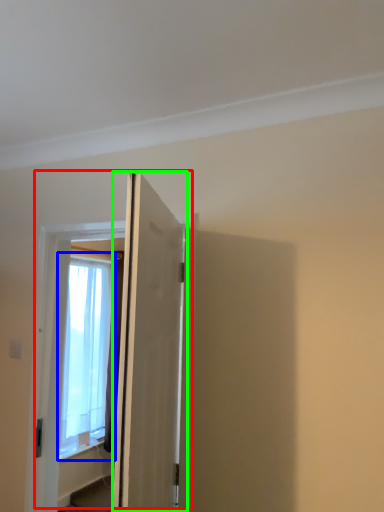
Question: Which object is positioned farthest from door (highlighted by a red box)? Select from window (highlighted by a blue box) and door (highlighted by a green box).

Choices:
 (A) window
 (B) door

Answer: (A)